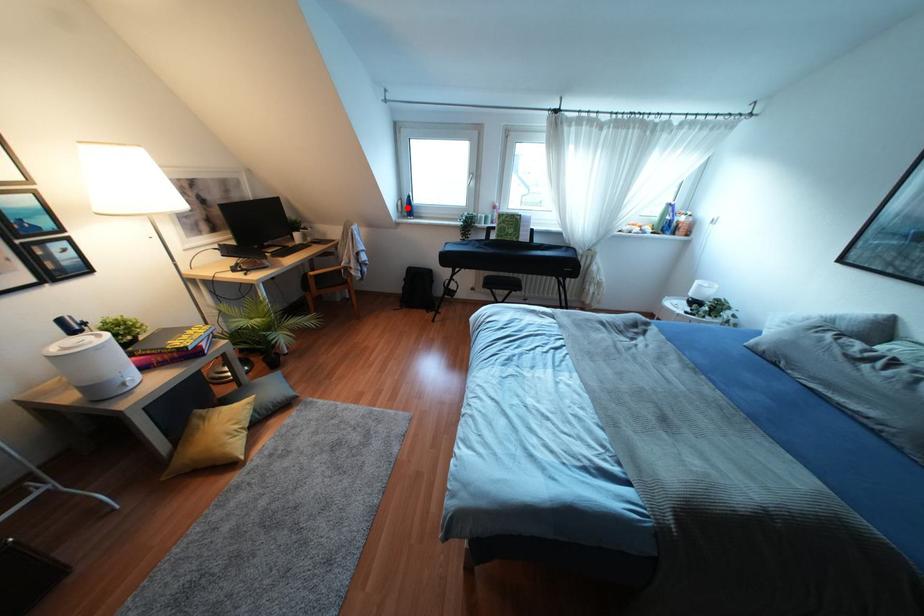
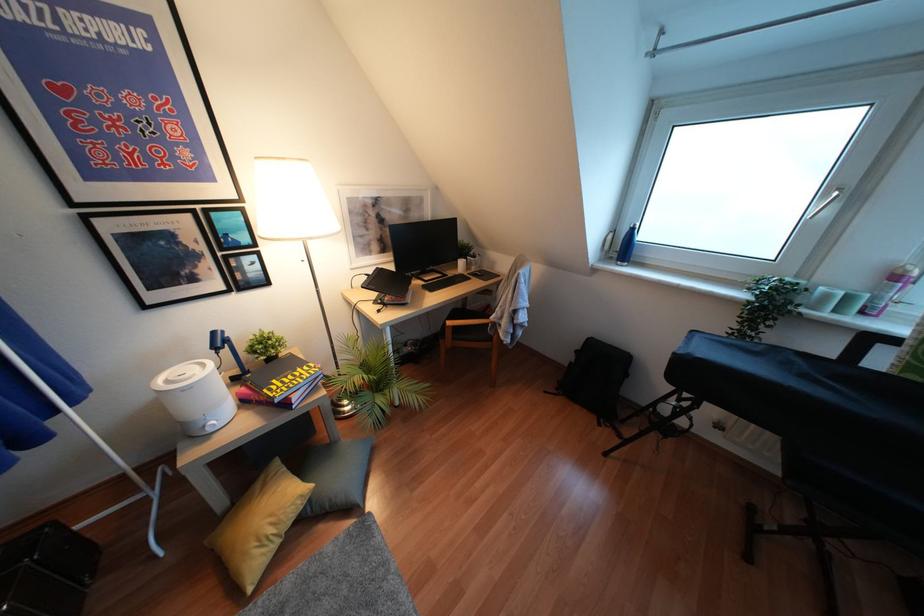
Find the pixel in the second image that matches the highlighted location in the first image.

(623, 246)